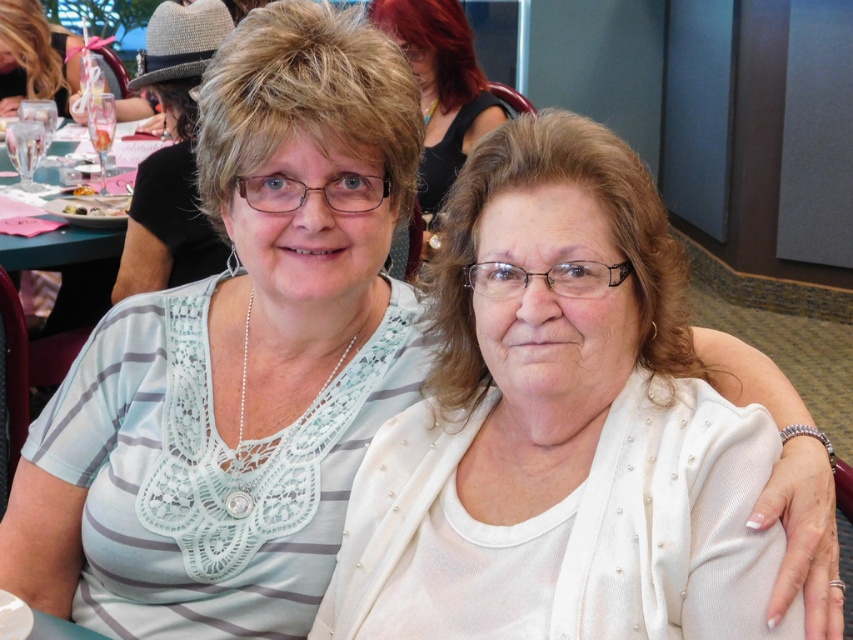
Which of these two, matte white glasses at center or matte black glass at upper left, stands taller?

matte white glasses at center

Describe the element at coordinates (440, 86) in the screenshot. I see `matte white glasses at center` at that location.

Identify the location of matte white glasses at center. (440, 86).

Is matte white glasses at center positioned at the back of translucent plastic cup at upper left?

No, matte white glasses at center is in front of translucent plastic cup at upper left.

Between point (393, 253) and point (74, 193), which one is positioned behind?

The point (74, 193) is behind.

The width and height of the screenshot is (853, 640). Find the location of `matte white glasses at center`. matte white glasses at center is located at coordinates (440, 86).

Does matte black glass at upper left appear on the right side of translucent plastic cup at upper left?

No, matte black glass at upper left is not to the right of translucent plastic cup at upper left.

This screenshot has width=853, height=640. What are the coordinates of `matte black glass at upper left` in the screenshot? It's located at (33, 58).